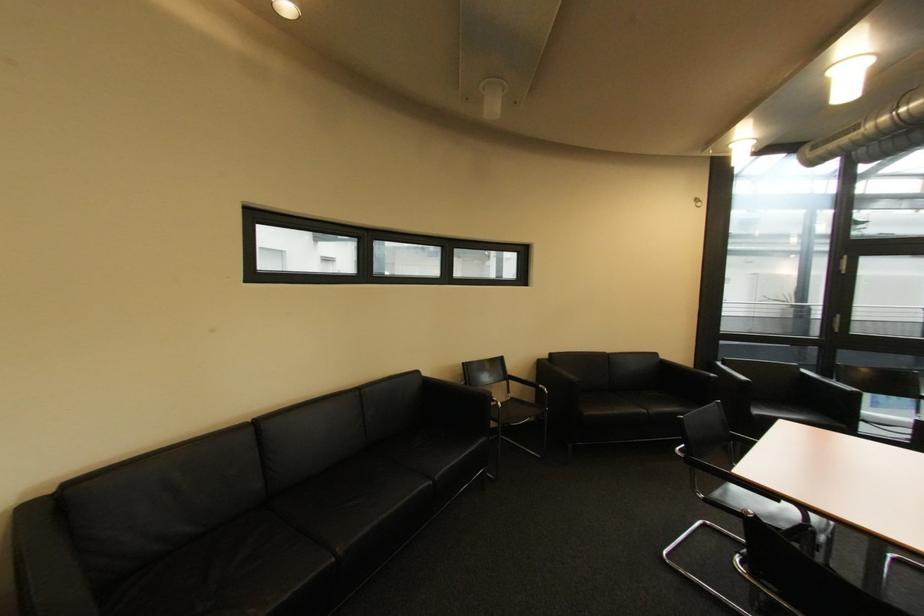
Image resolution: width=924 pixels, height=616 pixels. What do you see at coordinates (708, 468) in the screenshot?
I see `a metal chair armrest` at bounding box center [708, 468].